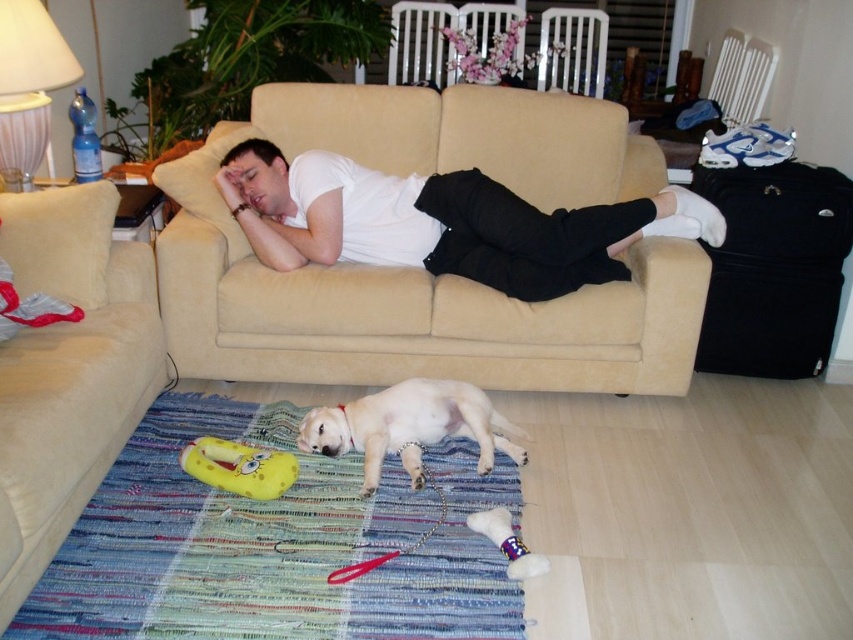
The height and width of the screenshot is (640, 853). Describe the element at coordinates (421, 266) in the screenshot. I see `beige fabric couch at center` at that location.

Does beige fabric couch at center have a greater height compared to white matte shirt at center?

Yes.

Which is behind, point (396, 364) or point (403, 180)?

Positioned behind is point (403, 180).

Image resolution: width=853 pixels, height=640 pixels. Find the location of `beige fabric couch at center`. beige fabric couch at center is located at coordinates (421, 266).

Is beige fabric couch at lower left to the left of white matte shirt at center from the viewer's perspective?

Indeed, beige fabric couch at lower left is positioned on the left side of white matte shirt at center.

In the scene shown: Can you confirm if beige fabric couch at lower left is thinner than white matte shirt at center?

Yes, beige fabric couch at lower left is thinner than white matte shirt at center.

Which is in front, point (28, 573) or point (467, 202)?

Positioned in front is point (28, 573).

The image size is (853, 640). What are the coordinates of `beige fabric couch at lower left` in the screenshot? It's located at (68, 369).

Who is shorter, beige fabric couch at center or yellow rubber dog toy at lower center?

With less height is yellow rubber dog toy at lower center.

Is beige fabric couch at center above yellow rubber dog toy at lower center?

Yes, beige fabric couch at center is above yellow rubber dog toy at lower center.

Locate an element on the screen. beige fabric couch at center is located at coordinates (421, 266).